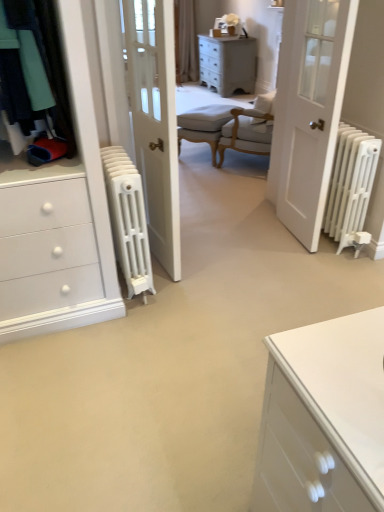
You are a GUI agent. You are given a task and a screenshot of the screen. Output one action in this format:
    pyautogui.click(x=<x>, y=<y>)
    Task: Click on the distressed white chest of drawers at upper center
    
    Given the screenshot: What is the action you would take?
    pyautogui.click(x=228, y=63)

How much space does white matte radiator at right, marked as the second radiator in a left-to-right arrangement, occupy horizontally?

The width of white matte radiator at right, marked as the second radiator in a left-to-right arrangement, is 54.86 centimeters.

The width and height of the screenshot is (384, 512). Find the location of `light beige fabric armchair at center`. light beige fabric armchair at center is located at coordinates (204, 125).

From the picture: Can you confirm if white matte radiator at right, marked as the second radiator in a left-to-right arrangement, is taller than distressed white chest of drawers at upper center?

In fact, white matte radiator at right, marked as the second radiator in a left-to-right arrangement, may be shorter than distressed white chest of drawers at upper center.

Is white matte radiator at right, the 1th radiator viewed from the right, aimed at distressed white chest of drawers at upper center?

No, white matte radiator at right, the 1th radiator viewed from the right, is not aimed at distressed white chest of drawers at upper center.

From the image's perspective, between white matte radiator at right, marked as the second radiator in a left-to-right arrangement, and distressed white chest of drawers at upper center, which one is located above?

distressed white chest of drawers at upper center.

Does point (370, 148) lie behind point (240, 50)?

No, it is not.

Is beige fabric curtain at upper center in contact with white matte radiator at right?

There is a gap between beige fabric curtain at upper center and white matte radiator at right.

Is beige fabric curtain at upper center facing away from white matte radiator at right?

No.

How many degrees apart are the facing directions of beige fabric curtain at upper center and white matte radiator at right?

The facing directions of beige fabric curtain at upper center and white matte radiator at right are 91.3 degrees apart.

Does point (183, 64) come behind point (316, 173)?

Yes.

From a real-world perspective, is light beige fabric armchair at center below white matte radiator at right, marked as the second radiator in a left-to-right arrangement?

Yes, from a real-world perspective, light beige fabric armchair at center is under white matte radiator at right, marked as the second radiator in a left-to-right arrangement.

Who is bigger, light beige fabric armchair at center or white matte radiator at right, marked as the second radiator in a left-to-right arrangement?

With larger size is light beige fabric armchair at center.

From the image's perspective, between light beige fabric armchair at center and white matte radiator at right, marked as the second radiator in a left-to-right arrangement, who is located below?

white matte radiator at right, marked as the second radiator in a left-to-right arrangement, from the image's perspective.

Does point (187, 117) come closer to viewer compared to point (349, 186)?

No, (187, 117) is behind (349, 186).

Would you say white matte radiator at left, which is counted as the 1th radiator, starting from the left, is inside or outside beige fabric curtain at upper center?

white matte radiator at left, which is counted as the 1th radiator, starting from the left, exists outside the volume of beige fabric curtain at upper center.

Is white matte radiator at left, which is counted as the 1th radiator, starting from the left, wider or thinner than beige fabric curtain at upper center?

Considering their sizes, white matte radiator at left, which is counted as the 1th radiator, starting from the left, looks broader than beige fabric curtain at upper center.

Considering the sizes of objects white matte radiator at left, which is the second radiator from right to left, and beige fabric curtain at upper center in the image provided, who is bigger, white matte radiator at left, which is the second radiator from right to left, or beige fabric curtain at upper center?

beige fabric curtain at upper center is bigger.

Is point (184, 118) closer to viewer compared to point (119, 201)?

That is False.

Between light beige fabric armchair at center and white matte radiator at left, which is counted as the 1th radiator, starting from the left, which one has less height?

Standing shorter between the two is light beige fabric armchair at center.

Consider the image. Is light beige fabric armchair at center positioned behind white matte radiator at left, which is counted as the 1th radiator, starting from the left?

Yes, it is behind white matte radiator at left, which is counted as the 1th radiator, starting from the left.

Does white matte radiator at left, which is counted as the 1th radiator, starting from the left, have a larger size compared to white matte radiator at right, the 1th radiator viewed from the right?

Correct, white matte radiator at left, which is counted as the 1th radiator, starting from the left, is larger in size than white matte radiator at right, the 1th radiator viewed from the right.

From a real-world perspective, between white matte radiator at left, which is counted as the 1th radiator, starting from the left, and white matte radiator at right, the 1th radiator viewed from the right, who is vertically higher?

From a 3D spatial view, white matte radiator at left, which is counted as the 1th radiator, starting from the left, is above.

Is white matte radiator at left, which is the second radiator from right to left, in front of or behind white matte radiator at right, the 1th radiator viewed from the right, in the image?

white matte radiator at left, which is the second radiator from right to left, is positioned closer to the viewer than white matte radiator at right, the 1th radiator viewed from the right.

Who is bigger, white matte radiator at right or beige fabric curtain at upper center?

beige fabric curtain at upper center is bigger.

Is white matte radiator at right positioned with its back to beige fabric curtain at upper center?

No, beige fabric curtain at upper center is not at the back of white matte radiator at right.

Image resolution: width=384 pixels, height=512 pixels. I want to click on door on the right side of beige fabric curtain at upper center, so click(309, 111).

Where is `the chest of drawers behind the white matte radiator at right, the 1th radiator viewed from the right`? The width and height of the screenshot is (384, 512). the chest of drawers behind the white matte radiator at right, the 1th radiator viewed from the right is located at coordinates (228, 63).

Where is `curtain on the left of white matte radiator at right`? curtain on the left of white matte radiator at right is located at coordinates (185, 41).

Considering their positions, is beige fabric curtain at upper center positioned closer to white matte radiator at right than white matte radiator at right, the 1th radiator viewed from the right?

Among the two, white matte radiator at right, the 1th radiator viewed from the right, is located nearer to white matte radiator at right.

From the image, which object appears to be nearer to beige fabric curtain at upper center, distressed white chest of drawers at upper center or white matte radiator at left, which is counted as the 1th radiator, starting from the left?

Based on the image, distressed white chest of drawers at upper center appears to be nearer to beige fabric curtain at upper center.

Estimate the real-world distances between objects in this image. Which object is further from white matte radiator at right, distressed white chest of drawers at upper center or light beige fabric armchair at center?

distressed white chest of drawers at upper center.

From the image, which object appears to be nearer to white matte radiator at right, the 1th radiator viewed from the right, white matte radiator at left, which is the second radiator from right to left, or light beige fabric armchair at center?

white matte radiator at left, which is the second radiator from right to left.

Considering their positions, is white matte radiator at right, marked as the second radiator in a left-to-right arrangement, positioned further to beige fabric curtain at upper center than white matte radiator at left, which is counted as the 1th radiator, starting from the left?

white matte radiator at left, which is counted as the 1th radiator, starting from the left, is positioned further to the anchor beige fabric curtain at upper center.

Estimate the real-world distances between objects in this image. Which object is further from light beige fabric armchair at center, distressed white chest of drawers at upper center or beige fabric curtain at upper center?

Among the two, beige fabric curtain at upper center is located further to light beige fabric armchair at center.

Looking at the image, which one is located closer to white matte radiator at right, the 1th radiator viewed from the right, distressed white chest of drawers at upper center or light beige fabric armchair at center?

Among the two, light beige fabric armchair at center is located nearer to white matte radiator at right, the 1th radiator viewed from the right.

From the image, which object appears to be farther from white matte radiator at right, the 1th radiator viewed from the right, distressed white chest of drawers at upper center or beige fabric curtain at upper center?

beige fabric curtain at upper center.

Find the location of `radiator located between white matte radiator at left, which is counted as the 1th radiator, starting from the left, and light beige fabric armchair at center in the depth direction`. radiator located between white matte radiator at left, which is counted as the 1th radiator, starting from the left, and light beige fabric armchair at center in the depth direction is located at coordinates (351, 187).

Find the location of a particular element. door situated between white matte radiator at left, which is the second radiator from right to left, and white matte radiator at right, marked as the second radiator in a left-to-right arrangement, from left to right is located at coordinates (309, 111).

The height and width of the screenshot is (512, 384). I want to click on armchair located between white matte radiator at right, the 1th radiator viewed from the right, and distressed white chest of drawers at upper center in the depth direction, so click(x=204, y=125).

Image resolution: width=384 pixels, height=512 pixels. I want to click on radiator between white matte radiator at left, which is the second radiator from right to left, and distressed white chest of drawers at upper center, along the z-axis, so click(351, 187).